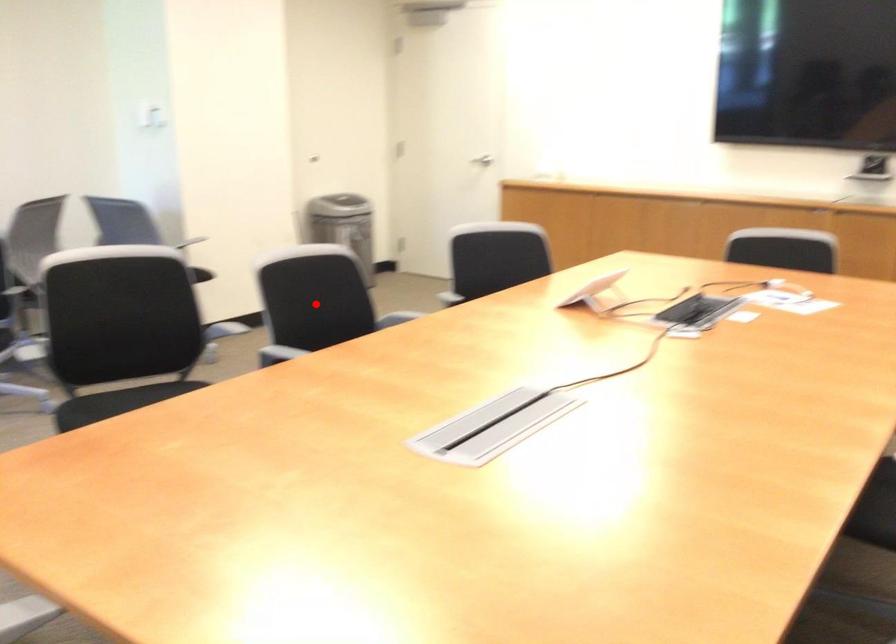
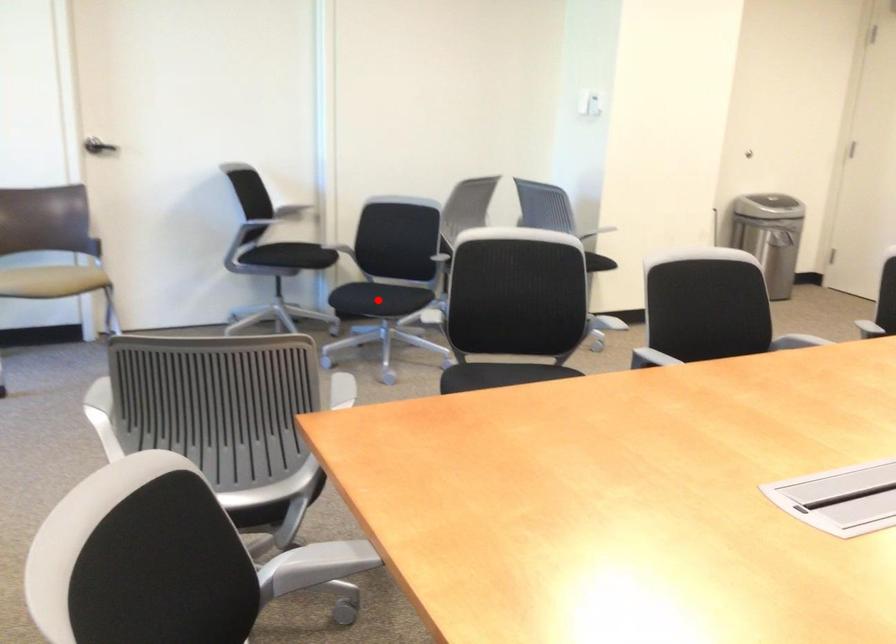
I am providing you with two images of the same scene from different viewpoints. A red point is marked on the first image and another point is marked on the second image. Are the points marked in image1 and image2 representing the same 3D position?

→ No